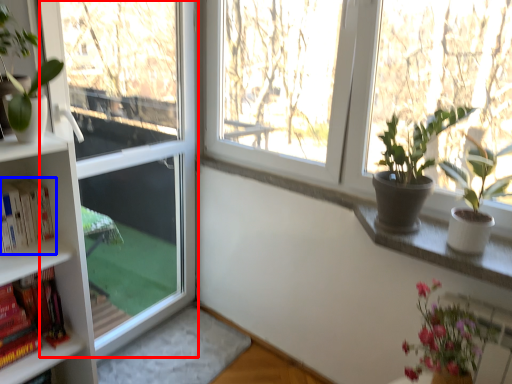
Question: Which point is closer to the camera, screen door (highlighted by a red box) or book (highlighted by a blue box)?

Choices:
 (A) screen door
 (B) book

Answer: (B)